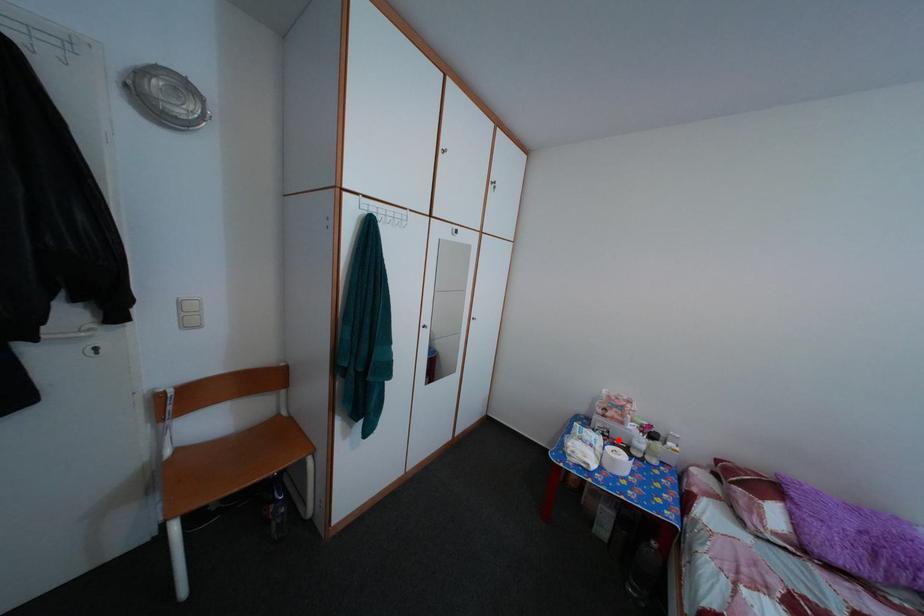
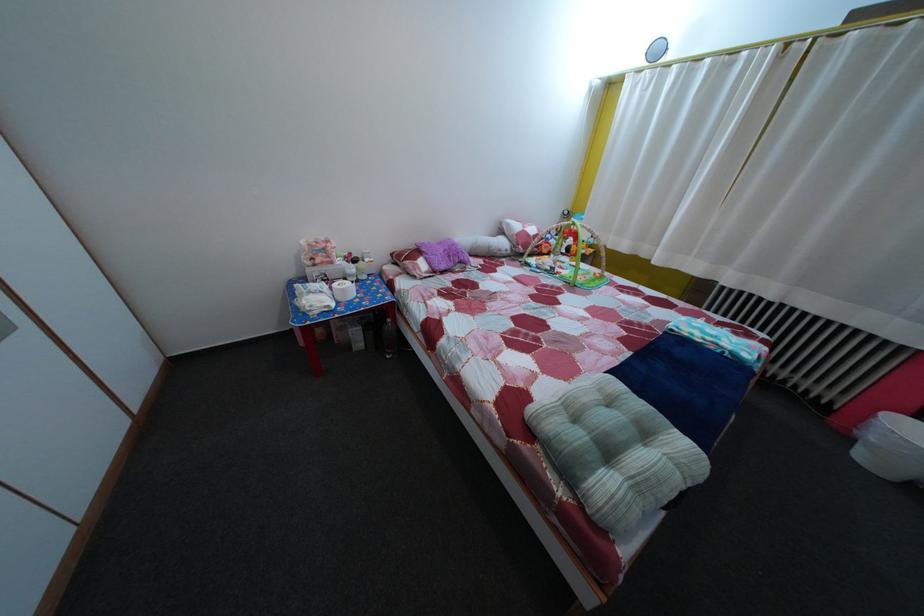
Find the pixel in the second image that matches the highlighted location in the first image.

(335, 284)